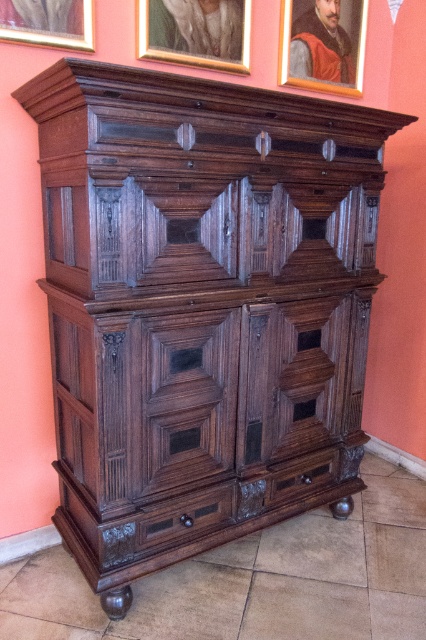
Between point (325, 42) and point (14, 17), which one is positioned in front?

Point (14, 17) is more forward.

Does wooden frame at upper center appear on the left side of brushed metal picture frame at upper left?

In fact, wooden frame at upper center is to the right of brushed metal picture frame at upper left.

Is point (296, 19) less distant than point (32, 3)?

No.

Where is `wooden frame at upper center`? The width and height of the screenshot is (426, 640). wooden frame at upper center is located at coordinates tap(322, 45).

Is the position of goldmetallicpicture frame at upper center more distant than that of wooden frame at upper center?

That is False.

Can you confirm if goldmetallicpicture frame at upper center is shorter than wooden frame at upper center?

Yes.

Locate an element on the screen. Image resolution: width=426 pixels, height=640 pixels. goldmetallicpicture frame at upper center is located at coordinates coord(195,32).

Is goldmetallicpicture frame at upper center below brushed metal picture frame at upper left?

Incorrect, goldmetallicpicture frame at upper center is not positioned below brushed metal picture frame at upper left.

Is point (193, 38) farther from viewer compared to point (31, 20)?

Yes, it is.

Identify the location of goldmetallicpicture frame at upper center. The height and width of the screenshot is (640, 426). (195, 32).